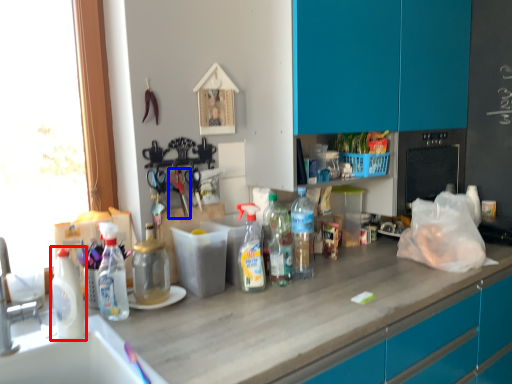
Question: Among these objects, which one is farthest to the camera, bottle (highlighted by a red box) or scissors (highlighted by a blue box)?

Choices:
 (A) bottle
 (B) scissors

Answer: (B)